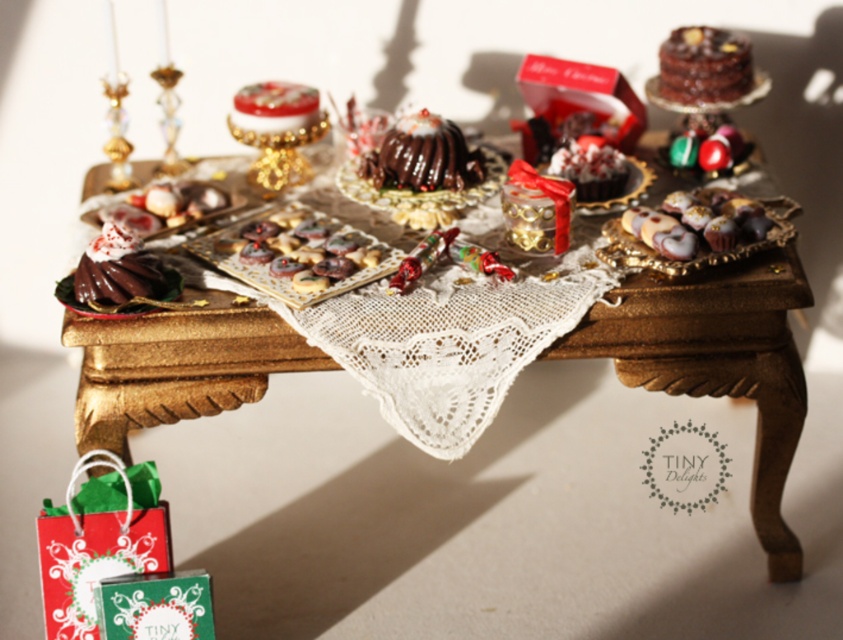
You are a guest at the table and want to reach for the shiny chocolate cake at center and the shiny gold cake at center. Which cake can you grab first without moving your hand?

The shiny chocolate cake at center is closer to the viewer than the shiny gold cake at center, so you can grab the shiny chocolate cake at center first without moving your hand.

You are a tiny guest at this miniature holiday table. You want to choose the cake that has the smallest height. Which cake should you pick between the chocolate glossy cake at center and the shiny gold cake at center?

The chocolate glossy cake at center is thinner than the shiny gold cake at center, so you should pick the chocolate glossy cake at center as it has the smallest height.